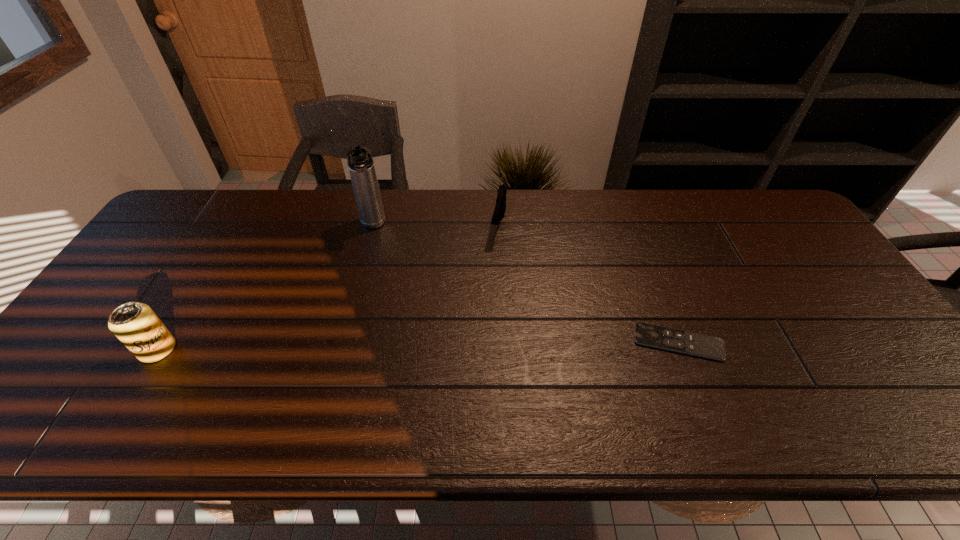
The image size is (960, 540). In the image, there is a desktop. Identify the location of vacant area at the near edge. (145, 390).

Find the location of a particular element. This screenshot has width=960, height=540. vacant position at the left edge of the desktop is located at coordinates pos(175,278).

This screenshot has width=960, height=540. In the image, there is a desktop. In order to click on vacant space at the right edge in this screenshot , I will do `click(819, 308)`.

Locate an element on the screen. vacant region at the far left corner is located at coordinates (174, 212).

What are the coordinates of `free space at the near left corner of the desktop` in the screenshot? It's located at (60, 384).

In the image, there is a desktop. At what (x,y) coordinates should I click in order to perform the action: click on blank space at the far right corner. Please return your answer as a coordinate pair (x, y). Looking at the image, I should click on (796, 228).

This screenshot has height=540, width=960. I want to click on vacant point at the near right corner, so click(858, 395).

Locate an element on the screen. Image resolution: width=960 pixels, height=540 pixels. vacant space in between the second tallest object and the tallest object is located at coordinates (265, 287).

Locate an element on the screen. The image size is (960, 540). vacant space that's between the third object from right to left and the rightmost object is located at coordinates (525, 284).

Where is `vacant region between the leftmost object and the tallest object`? The height and width of the screenshot is (540, 960). vacant region between the leftmost object and the tallest object is located at coordinates (265, 287).